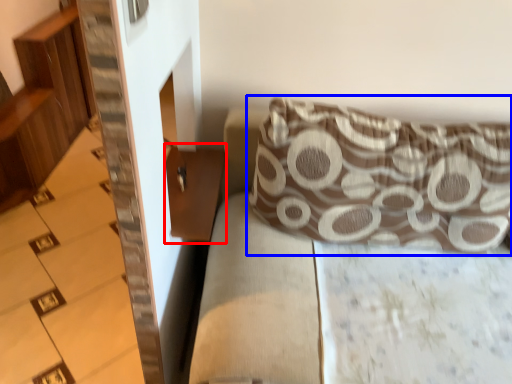
Question: Which of the following is the farthest to the observer, table (highlighted by a red box) or pillow (highlighted by a blue box)?

Choices:
 (A) table
 (B) pillow

Answer: (A)